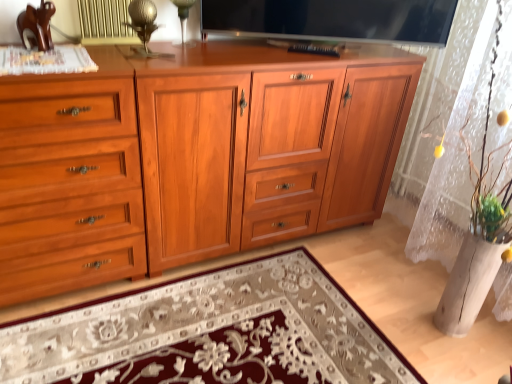
Find the location of `vacant space to the right of metallic gold table lamp at upper center, placed as the second table lamp when sorted from back to front`. vacant space to the right of metallic gold table lamp at upper center, placed as the second table lamp when sorted from back to front is located at coordinates (194, 62).